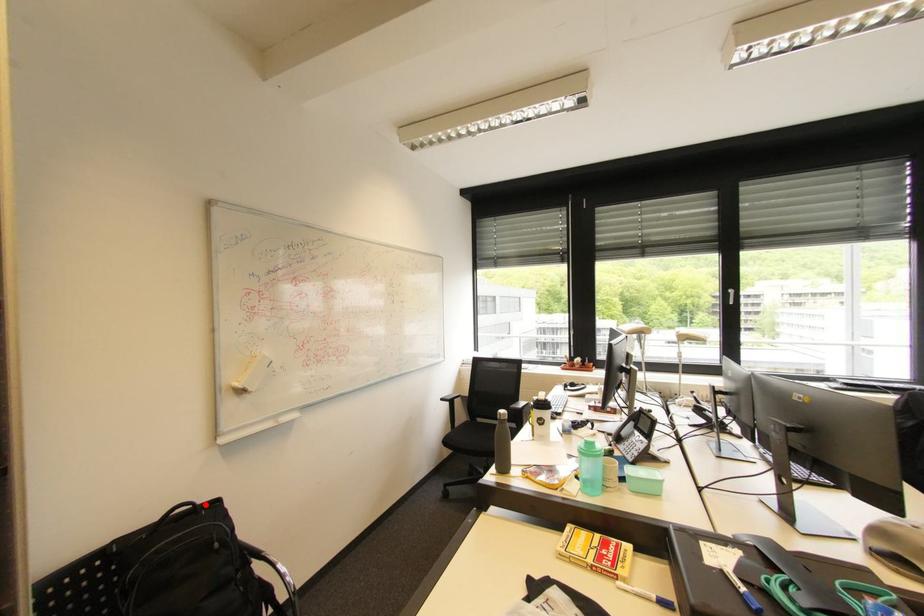
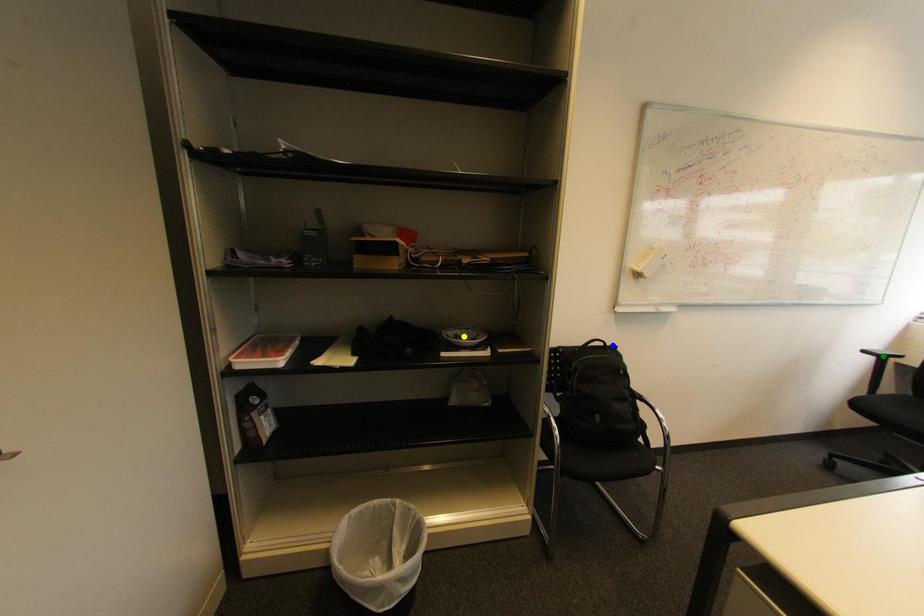
Question: I am providing you with two images of the same scene from different viewpoints. A red point is marked on the first image. You are given multiple points on the second image. In image 2, which mark is for the same physical point as the one in image 1?

Choices:
 (A) green point
 (B) yellow point
 (C) blue point

Answer: (C)